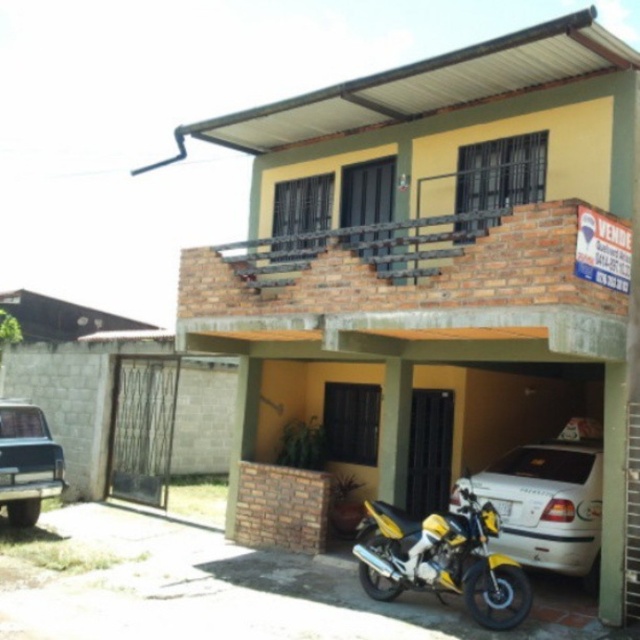
Question: Which of the following is the closest to the observer?

Choices:
 (A) matte black truck at lower left
 (B) white matte car at lower right

Answer: (B)

Question: Can you confirm if white matte car at lower right is bigger than matte black truck at lower left?

Choices:
 (A) yes
 (B) no

Answer: (A)

Question: Among these objects, which one is nearest to the camera?

Choices:
 (A) yellow matte motorcycle at lower center
 (B) white matte car at lower right
 (C) matte black truck at lower left

Answer: (A)

Question: Which point appears farthest from the camera in this image?

Choices:
 (A) (481, 552)
 (B) (556, 481)

Answer: (B)

Question: Does white matte car at lower right appear over matte black truck at lower left?

Choices:
 (A) yes
 (B) no

Answer: (B)

Question: Is the position of white matte car at lower right less distant than that of matte black truck at lower left?

Choices:
 (A) no
 (B) yes

Answer: (B)